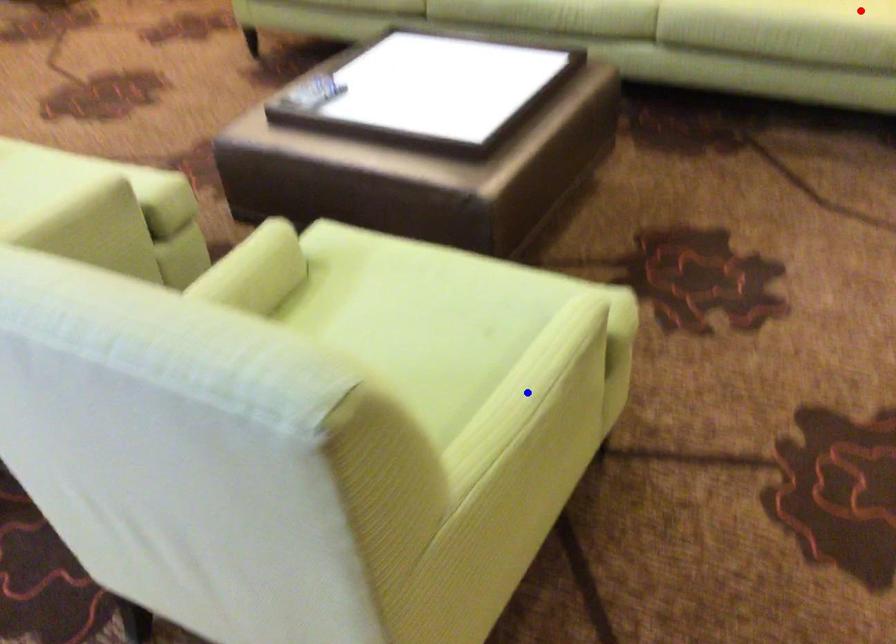
Question: Two points are marked on the image. Which point is closer to the camera?

Choices:
 (A) Blue point is closer.
 (B) Red point is closer.

Answer: (A)